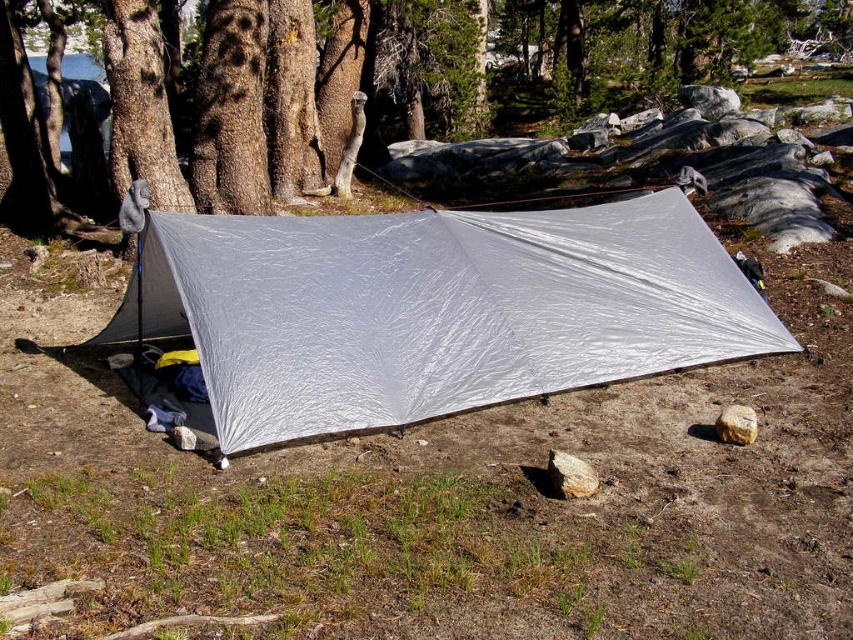
Question: Which point is closer to the camera?

Choices:
 (A) (258, 24)
 (B) (581, 291)

Answer: (B)

Question: Which point is farther to the camera?

Choices:
 (A) silver/reflective tarp at center
 (B) smooth bark tree at center

Answer: (B)

Question: Can you confirm if silver/reflective tarp at center is positioned to the right of smooth bark tree at center?

Choices:
 (A) yes
 (B) no

Answer: (B)

Question: Can you confirm if silver/reflective tarp at center is bigger than smooth bark tree at center?

Choices:
 (A) yes
 (B) no

Answer: (B)

Question: Is silver/reflective tarp at center wider than smooth bark tree at center?

Choices:
 (A) yes
 (B) no

Answer: (B)